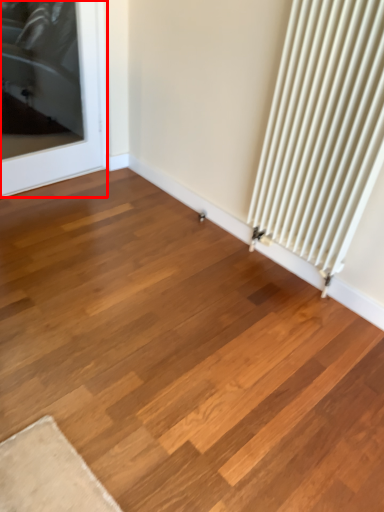
Question: Considering the relative positions of door (annotated by the red box) and radiator in the image provided, where is door (annotated by the red box) located with respect to the staircase?

Choices:
 (A) left
 (B) right

Answer: (A)